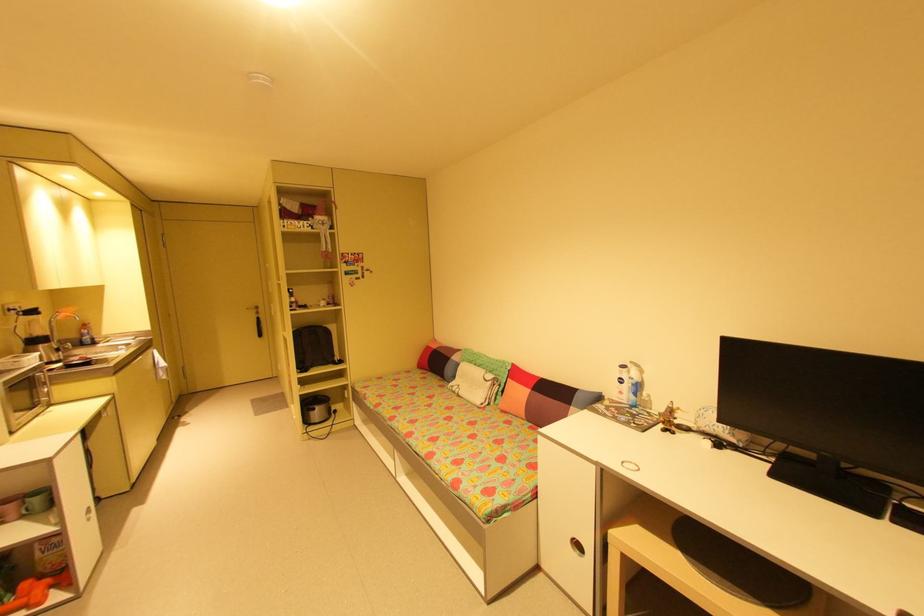
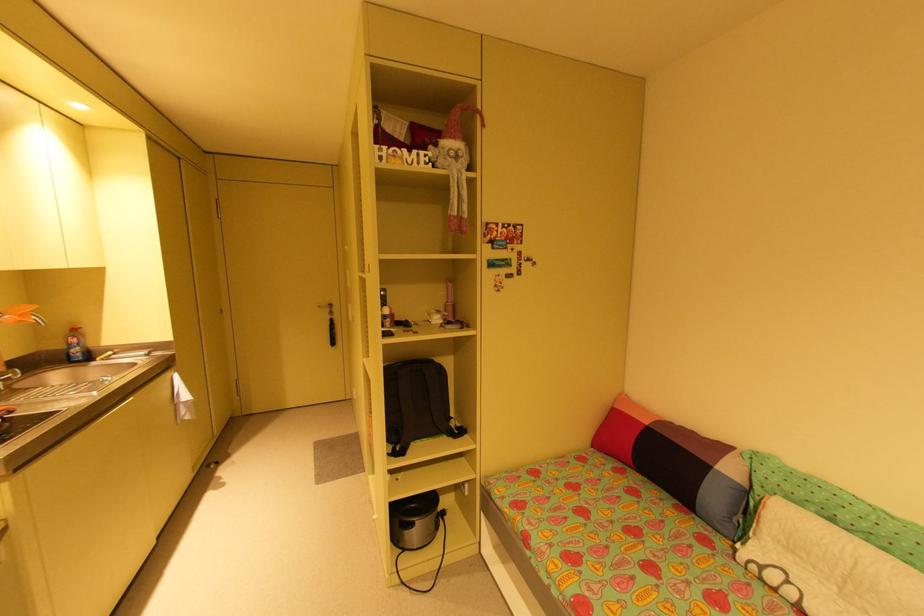
Find the pixel in the second image that matches (345,362) in the first image.

(466, 431)